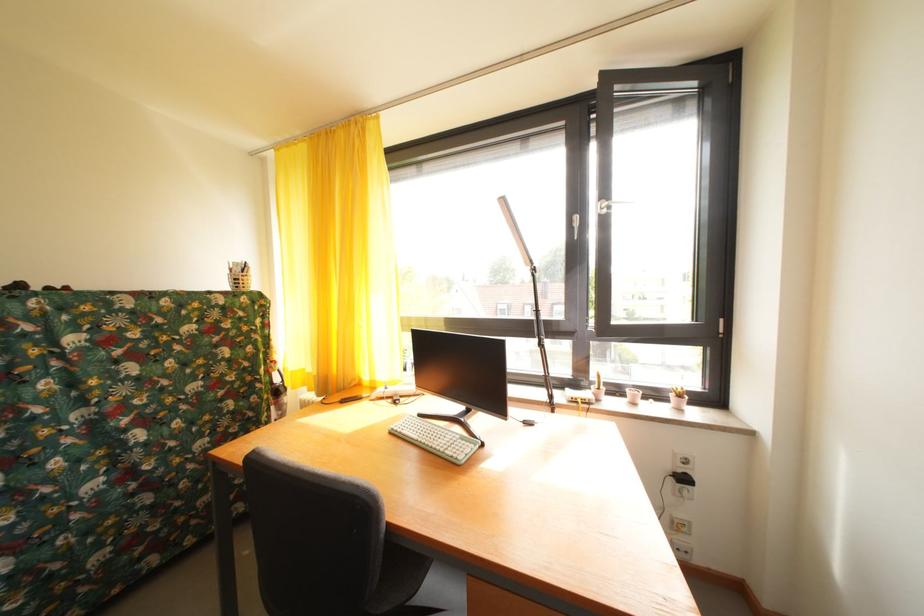
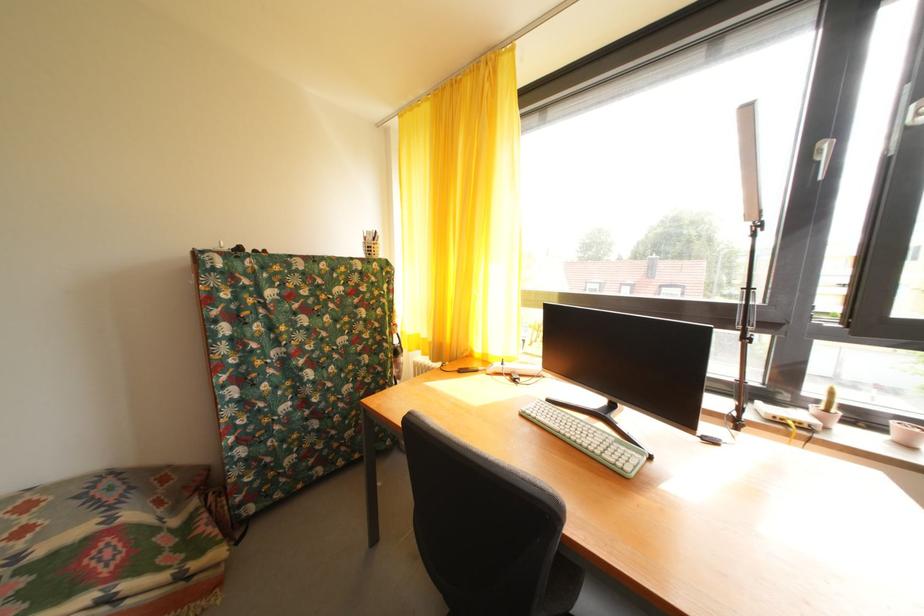
The point at (608, 394) is marked in the first image. Where is the corresponding point in the second image?

(836, 416)